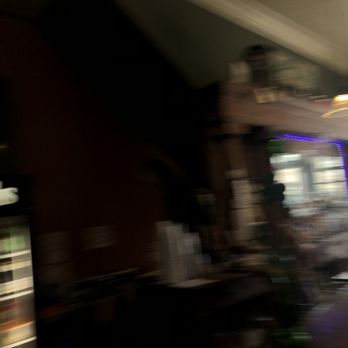
In order to click on plant in this screenshot , I will do coord(273,186), coord(279,257), coord(277,145), coord(261,229).